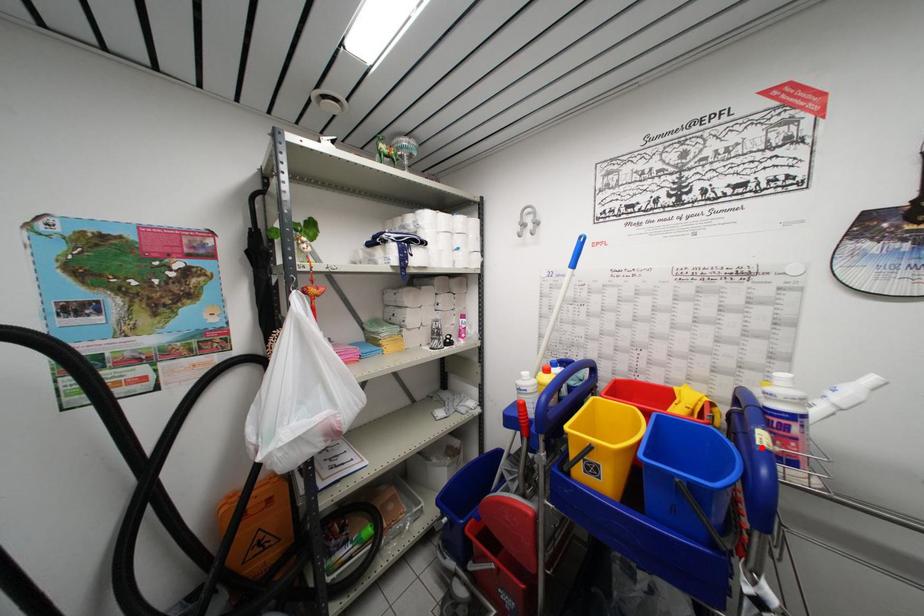
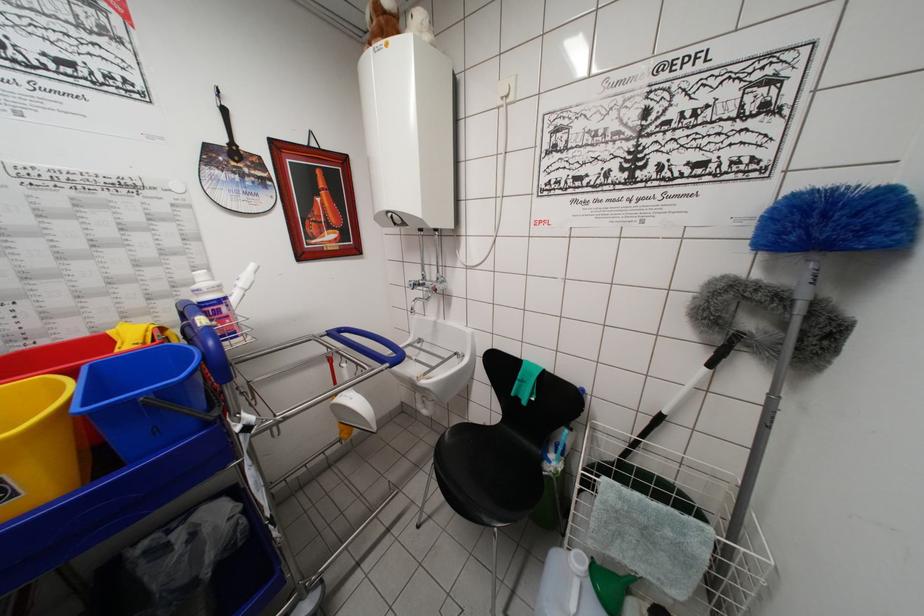
In the second image, find the point that corresponds to the highlighted location in the first image.

(202, 330)